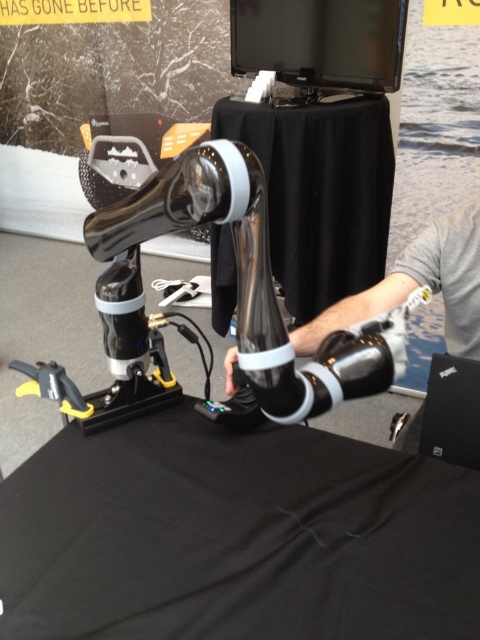
Based on the photo, you are a robotic arm operator. You need to place a small tool on the black fabric table at center. Where exactly should you position the robotic arm to place the tool on the table?

The robotic arm should position the tool at the 2D coordinates point (x=236, y=536) to place it on the black fabric table at center.

What is located at the point with coordinates (320, 193) in the image?

The point at coordinates (320, 193) is occupied by the black matte table at center.

You are setting up a presentation and need to place a 40 cm long presentation material between the black fabric table at center and the black matte laptop at lower right. Can the material fit in the space between them?

The black fabric table at center and black matte laptop at lower right are 41.33 centimeters apart, so the 40 cm long presentation material can fit in the space between them since it is shorter than the available distance.